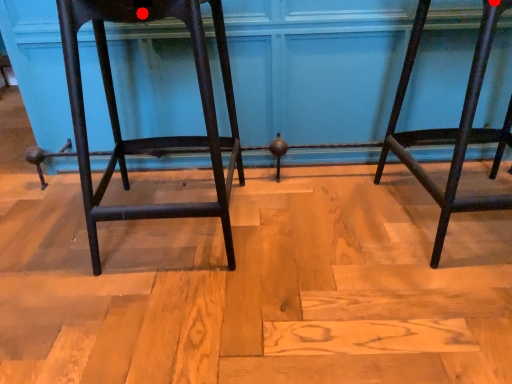
Question: Two points are circled on the image, labeled by A and B beside each circle. Which point is closer to the camera?

Choices:
 (A) A is closer
 (B) B is closer

Answer: (B)